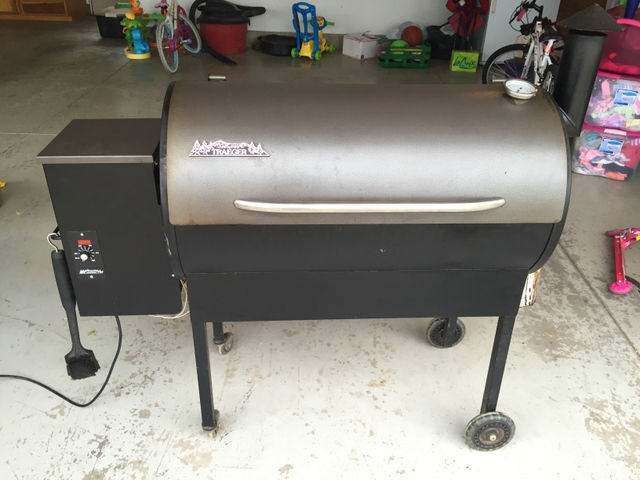
This screenshot has width=640, height=480. I want to click on floor, so click(329, 395).